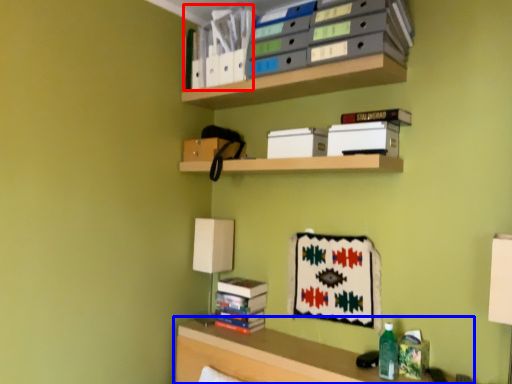
Question: Which object is further to the camera taking this photo, book (highlighted by a red box) or shelf (highlighted by a blue box)?

Choices:
 (A) book
 (B) shelf

Answer: (A)